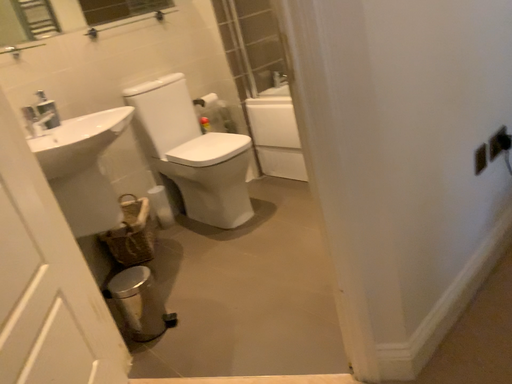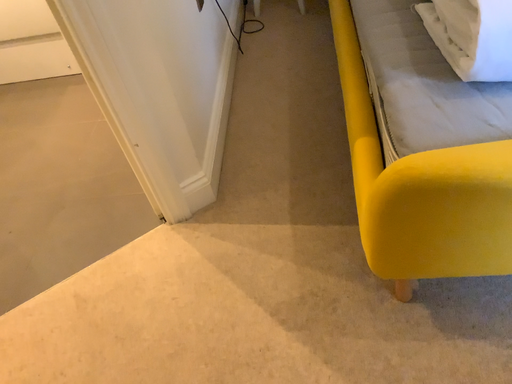
Question: Which way did the camera rotate in the video?

Choices:
 (A) rotated right
 (B) rotated left

Answer: (A)